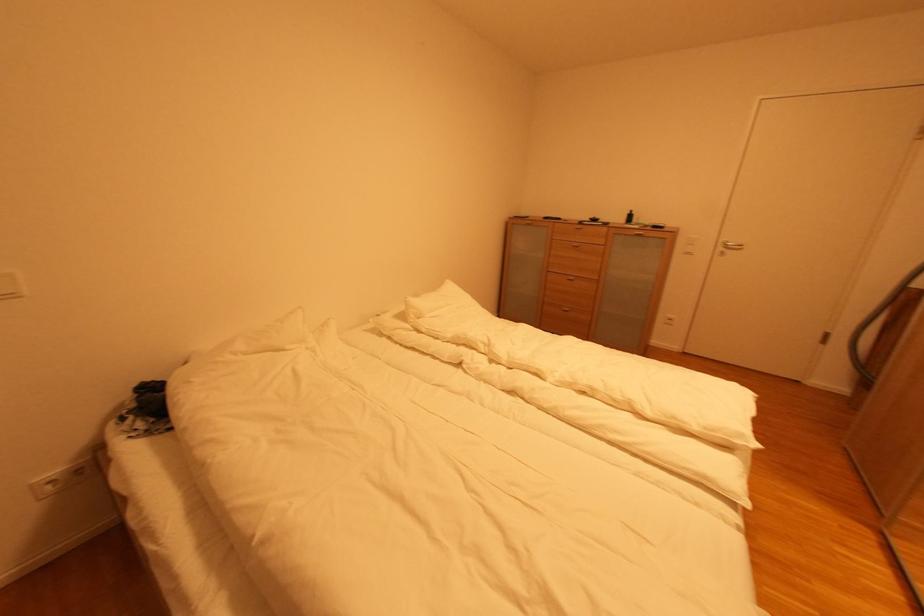
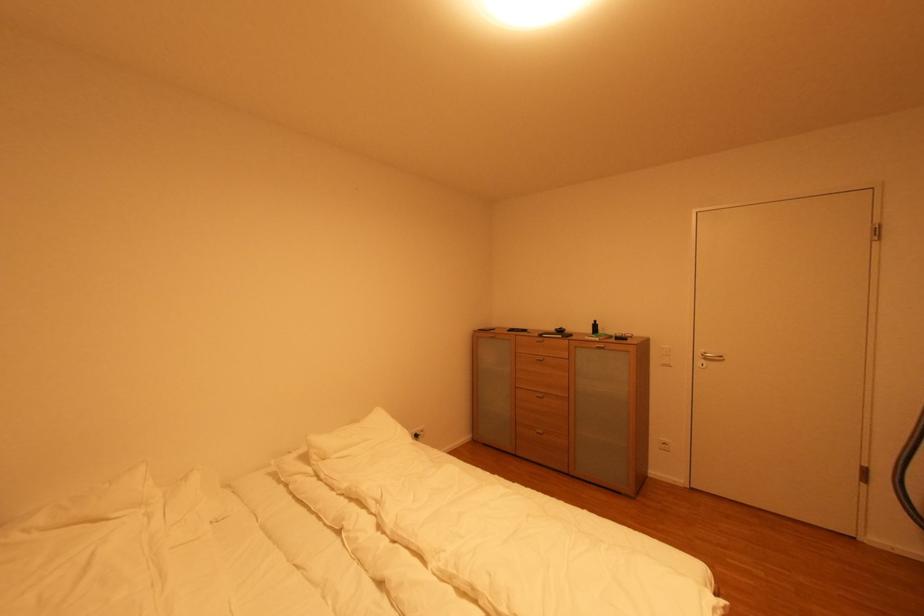
Where in the second image is the point corresponding to point 603,399 from the first image?

(485, 606)